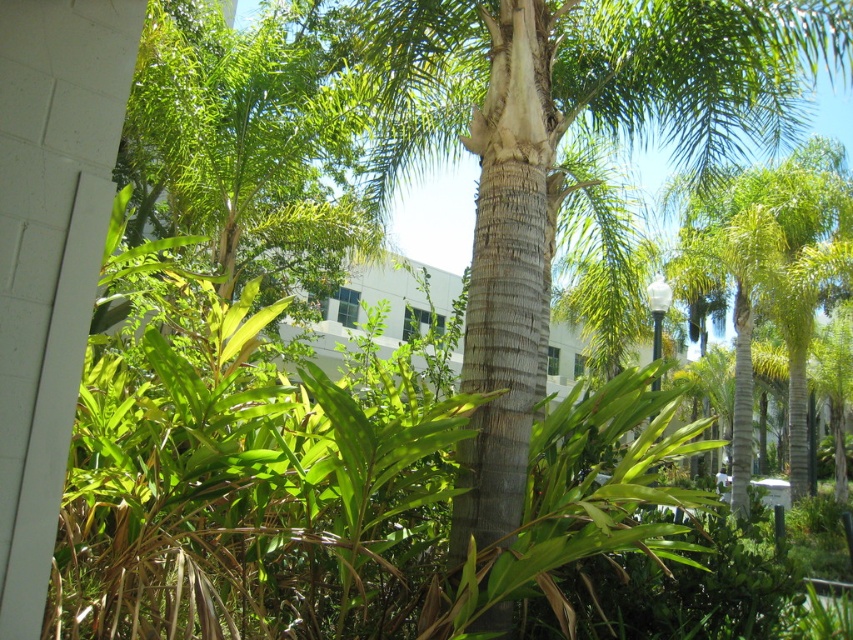
Question: Which point is closer to the camera?

Choices:
 (A) green textured palm tree at center
 (B) smooth brown trunk at center

Answer: (B)

Question: Which object appears closest to the camera in this image?

Choices:
 (A) green textured palm tree at center
 (B) smooth brown trunk at center

Answer: (B)

Question: Does smooth brown trunk at center appear over green textured palm tree at center?

Choices:
 (A) yes
 (B) no

Answer: (A)

Question: Which point is farther to the camera?

Choices:
 (A) (535, 172)
 (B) (787, 376)

Answer: (B)

Question: Can you confirm if smooth brown trunk at center is wider than green textured palm tree at center?

Choices:
 (A) no
 (B) yes

Answer: (A)

Question: Observing the image, what is the correct spatial positioning of smooth brown trunk at center in reference to green textured palm tree at center?

Choices:
 (A) below
 (B) above

Answer: (B)